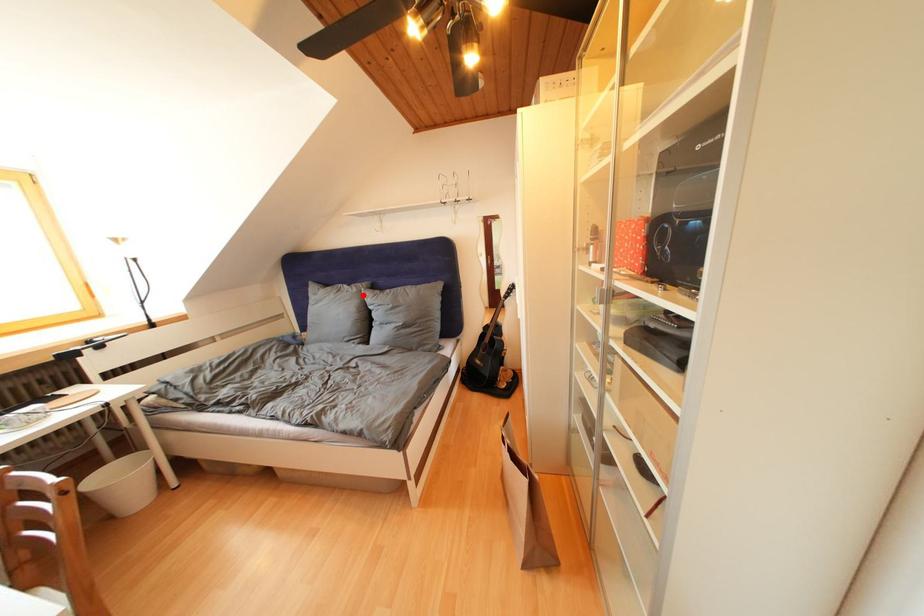
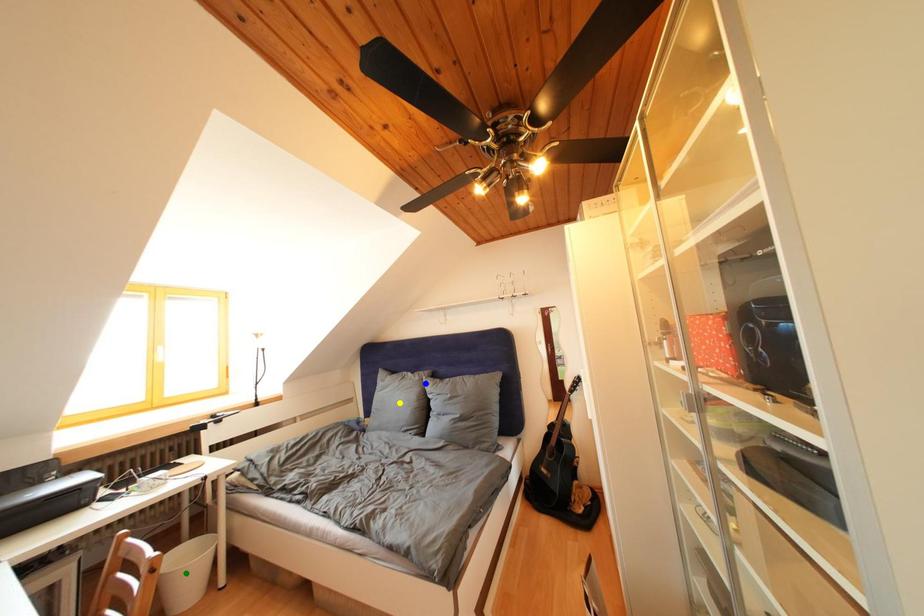
Question: I am providing you with two images of the same scene from different viewpoints. A red point is marked on the first image. You are given multiple points on the second image. Which spot in image 2 lines up with the point in image 1?

Choices:
 (A) yellow point
 (B) green point
 (C) blue point

Answer: (C)